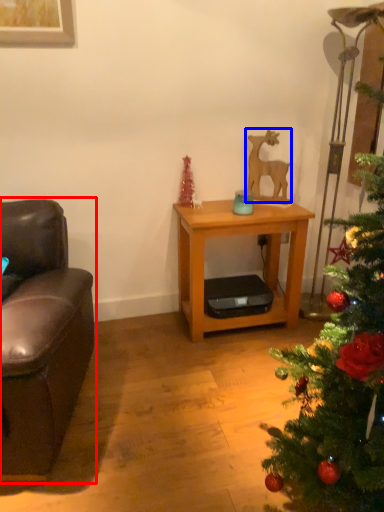
Question: Among these objects, which one is farthest to the camera, studio couch (highlighted by a red box) or animal (highlighted by a blue box)?

Choices:
 (A) studio couch
 (B) animal

Answer: (B)